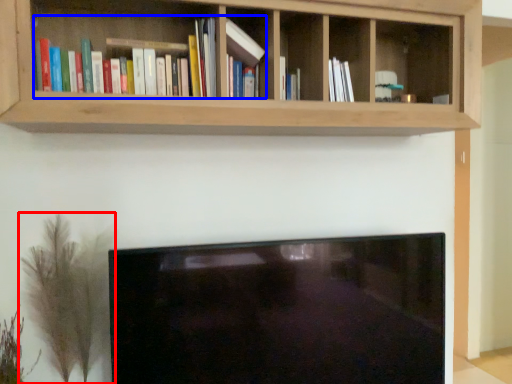
Question: Among these objects, which one is nearest to the camera, plant (highlighted by a red box) or book (highlighted by a blue box)?

Choices:
 (A) plant
 (B) book

Answer: (B)